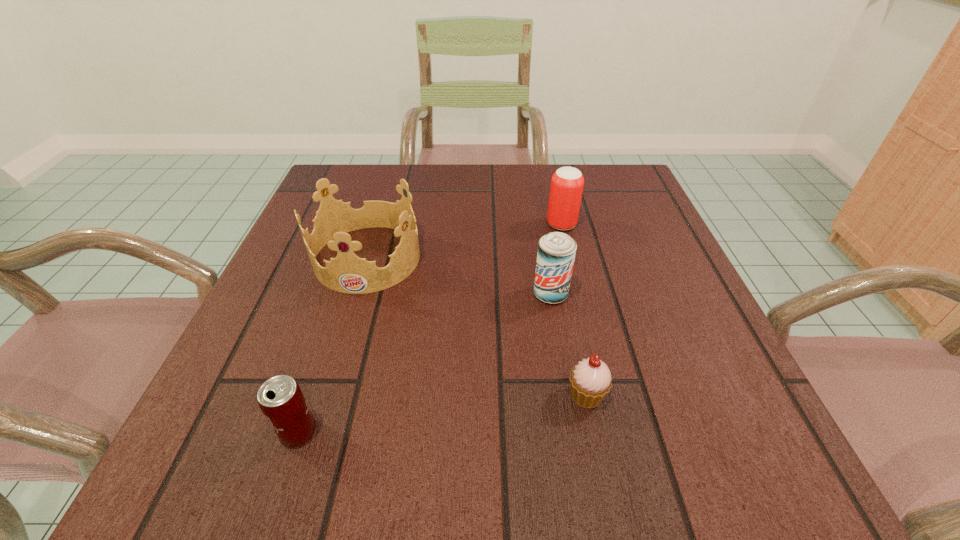
Locate an element on the screen. This screenshot has width=960, height=540. tiara is located at coordinates (347, 273).

You are a GUI agent. You are given a task and a screenshot of the screen. Output one action in this format:
    pyautogui.click(x=<x>, y=<y>)
    Task: Click on the farthest beer can
    The height and width of the screenshot is (540, 960).
    Given the screenshot: What is the action you would take?
    pyautogui.click(x=567, y=183)

This screenshot has height=540, width=960. I want to click on the second farthest beer can, so click(x=556, y=253).

Find the location of a particular element. the leftmost beer can is located at coordinates (281, 400).

Find the location of a particular element. the nearest object is located at coordinates (281, 400).

The height and width of the screenshot is (540, 960). Identify the location of cupcake. coord(590,380).

Locate an element on the screen. This screenshot has height=540, width=960. blank space located 0.080m on the front-facing side of the tiara is located at coordinates (347, 328).

Find the location of `free location located on the front of the farthest beer can`. free location located on the front of the farthest beer can is located at coordinates (582, 312).

The height and width of the screenshot is (540, 960). I want to click on vacant area located on the back of the second nearest beer can, so click(x=531, y=178).

What are the coordinates of `vacant space located 0.280m on the right of the nearest object` in the screenshot? It's located at (523, 433).